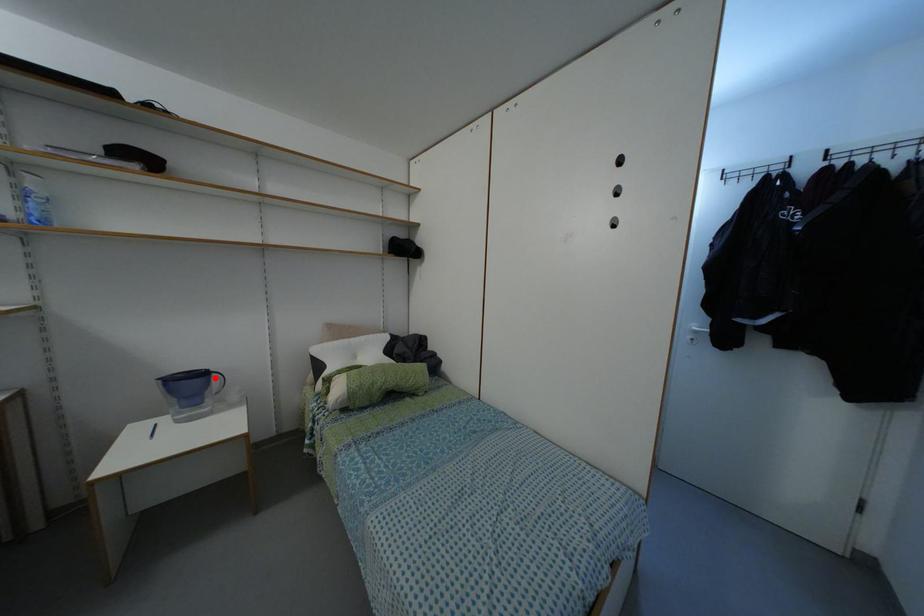
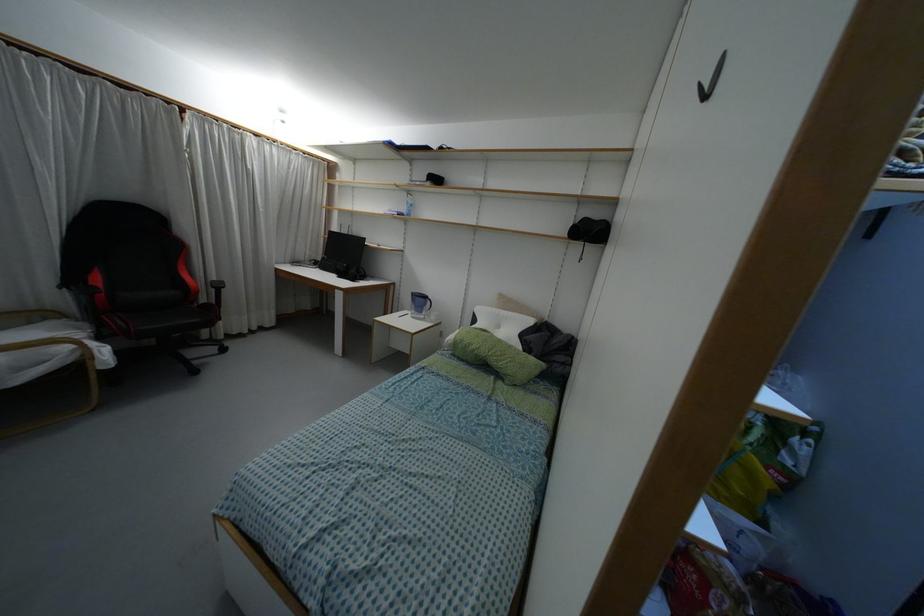
In the second image, find the point that corresponds to the highlighted location in the first image.

(428, 302)